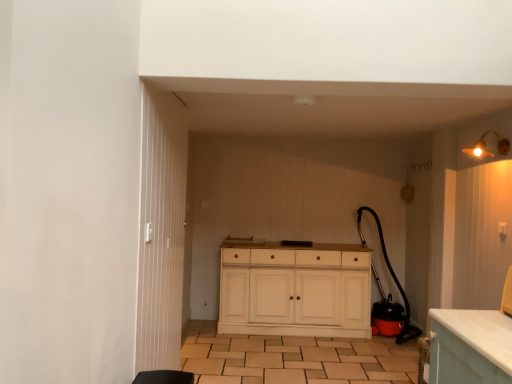
Locate an element on the screen. matte gold light fixture at upper right is located at coordinates (486, 149).

The height and width of the screenshot is (384, 512). I want to click on brown tile at center, so tap(294, 358).

What is the approximate height of brown tile at center?

6.10 centimeters.

Where is `matte gold light fixture at upper right`? The image size is (512, 384). matte gold light fixture at upper right is located at coordinates (486, 149).

From a real-world perspective, is white wooden door at center above or below white wood cabinet at center?

From a real-world perspective, white wooden door at center is physically above white wood cabinet at center.

From the image's perspective, which object appears higher, white wooden door at center or white wood cabinet at center?

white wooden door at center.

Considering the positions of objects white wooden door at center and white wood cabinet at center in the image provided, who is more to the left, white wooden door at center or white wood cabinet at center?

white wooden door at center.

How different are the orientations of white wooden door at center and white wood cabinet at center in degrees?

There is a 91.7-degree angle between the facing directions of white wooden door at center and white wood cabinet at center.

The height and width of the screenshot is (384, 512). I want to click on chest of drawers above the brown tile at center (from a real-world perspective), so click(x=295, y=290).

Is white wood cabinet at center beside brown tile at center?

No, white wood cabinet at center is not touching brown tile at center.

Is point (339, 298) farther from viewer compared to point (369, 346)?

Yes, point (339, 298) is behind point (369, 346).

What's the angular difference between matte gold light fixture at upper right and brown tile at center's facing directions?

There is a 98.2-degree angle between the facing directions of matte gold light fixture at upper right and brown tile at center.

Between matte gold light fixture at upper right and brown tile at center, which one has less height?

Standing shorter between the two is brown tile at center.

Is matte gold light fixture at upper right oriented towards brown tile at center?

No, matte gold light fixture at upper right is not aimed at brown tile at center.

Between point (474, 148) and point (226, 361), which one is positioned behind?

The point (226, 361) is farther.

From a real-world perspective, is brown tile at center physically below matte gold light fixture at upper right?

Yes.

Considering the sizes of brown tile at center and matte gold light fixture at upper right in the image, is brown tile at center wider or thinner than matte gold light fixture at upper right?

Considering their sizes, brown tile at center looks broader than matte gold light fixture at upper right.

In the image, is brown tile at center positioned in front of or behind matte gold light fixture at upper right?

In the image, brown tile at center appears behind matte gold light fixture at upper right.

Can we say brown tile at center lies outside matte gold light fixture at upper right?

Yes, brown tile at center is outside of matte gold light fixture at upper right.

Which is behind, white wooden door at center or brown tile at center?

Positioned behind is brown tile at center.

Is point (157, 132) closer to viewer compared to point (202, 332)?

Yes, point (157, 132) is closer to viewer.

Considering the sizes of objects white wooden door at center and brown tile at center in the image provided, who is smaller, white wooden door at center or brown tile at center?

white wooden door at center is smaller.

Based on the photo, is white wooden door at center taller than brown tile at center?

Indeed, white wooden door at center has a greater height compared to brown tile at center.

Between point (271, 379) and point (151, 110), which one is positioned behind?

The point (271, 379) is farther from the camera.

Considering the relative sizes of brown tile at center and white wooden door at center in the image provided, is brown tile at center wider than white wooden door at center?

Yes.

From the image's perspective, which one is positioned higher, brown tile at center or white wooden door at center?

white wooden door at center, from the image's perspective.

Looking at the image, does brown tile at center seem bigger or smaller compared to white wooden door at center?

Considering their sizes, brown tile at center takes up more space than white wooden door at center.

Is point (304, 292) less distant than point (167, 179)?

No, it is not.

Would you say white wood cabinet at center is a long distance from white wooden door at center?

white wood cabinet at center is far away from white wooden door at center.

The width and height of the screenshot is (512, 384). In order to click on door in front of the white wood cabinet at center in this screenshot , I will do `click(161, 230)`.

From a real-world perspective, which is physically above, white wood cabinet at center or white wooden door at center?

white wooden door at center.

Identify the location of door lying in front of the white wood cabinet at center. The image size is (512, 384). (161, 230).

This screenshot has width=512, height=384. What are the coordinates of `chest of drawers above the brown tile at center (from a real-world perspective)` in the screenshot? It's located at (295, 290).

Looking at this image, which object lies further to the anchor point white wood cabinet at center, matte gold light fixture at upper right or white wooden door at center?

The object further to white wood cabinet at center is matte gold light fixture at upper right.

Based on their spatial positions, is white wood cabinet at center or matte gold light fixture at upper right further from white wooden door at center?

matte gold light fixture at upper right is positioned further to the anchor white wooden door at center.

When comparing their distances from brown tile at center, does matte gold light fixture at upper right or white wooden door at center seem closer?

Among the two, white wooden door at center is located nearer to brown tile at center.

Considering their positions, is brown tile at center positioned further to white wood cabinet at center than white wooden door at center?

white wooden door at center lies further to white wood cabinet at center than the other object.

Looking at the image, which one is located closer to brown tile at center, matte gold light fixture at upper right or white wood cabinet at center?

Among the two, white wood cabinet at center is located nearer to brown tile at center.

Looking at the image, which one is located further to brown tile at center, white wood cabinet at center or matte gold light fixture at upper right?

Among the two, matte gold light fixture at upper right is located further to brown tile at center.

When comparing their distances from white wooden door at center, does matte gold light fixture at upper right or white wood cabinet at center seem further?

Based on the image, matte gold light fixture at upper right appears to be further to white wooden door at center.

Looking at this image, looking at the image, which one is located closer to white wood cabinet at center, brown tile at center or matte gold light fixture at upper right?

brown tile at center is closer to white wood cabinet at center.

You are a GUI agent. You are given a task and a screenshot of the screen. Output one action in this format:
    pyautogui.click(x=<x>, y=<y>)
    Task: Click on the light fixture between white wooden door at center and white wood cabinet at center from front to back
    The width and height of the screenshot is (512, 384).
    Given the screenshot: What is the action you would take?
    pyautogui.click(x=486, y=149)

Find the location of `the chest of drawers between matte gold light fixture at upper right and brown tile at center vertically`. the chest of drawers between matte gold light fixture at upper right and brown tile at center vertically is located at coordinates (295, 290).

Where is `tile between white wooden door at center and matte gold light fixture at upper right from left to right`? Image resolution: width=512 pixels, height=384 pixels. tile between white wooden door at center and matte gold light fixture at upper right from left to right is located at coordinates (294, 358).

The width and height of the screenshot is (512, 384). In order to click on tile between white wooden door at center and white wood cabinet at center from front to back in this screenshot , I will do `click(294, 358)`.